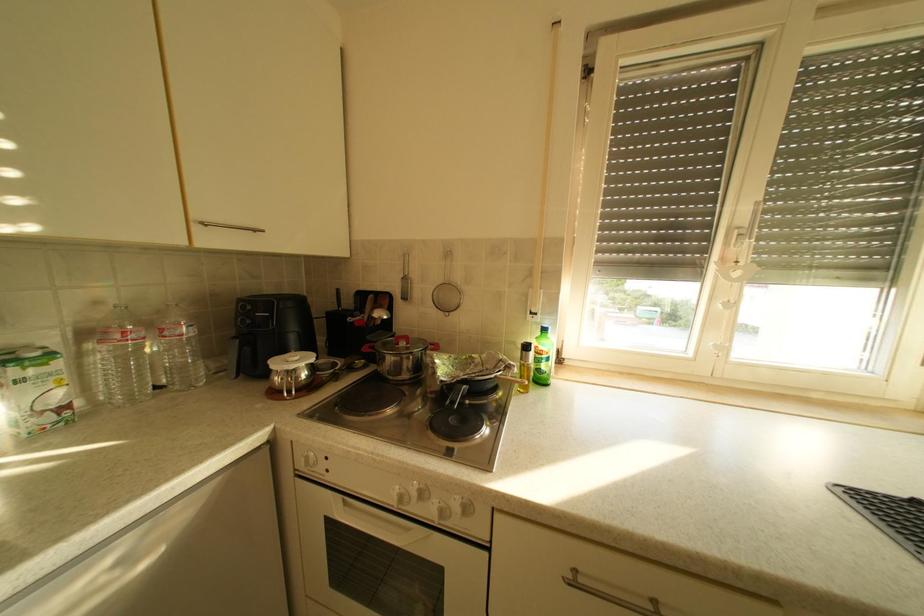
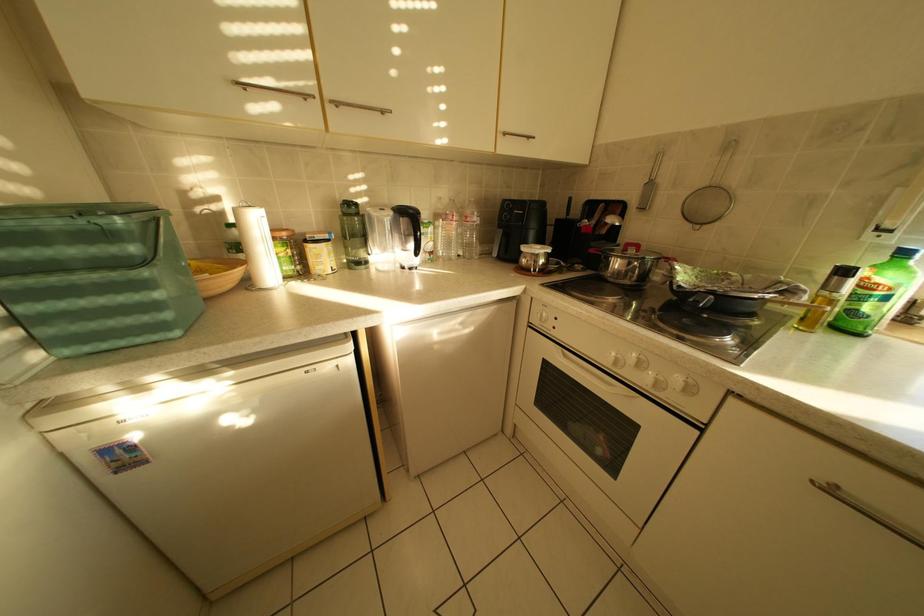
First-person continuous shooting, in which direction is the camera rotating?

The rotation direction of the camera is left-down.